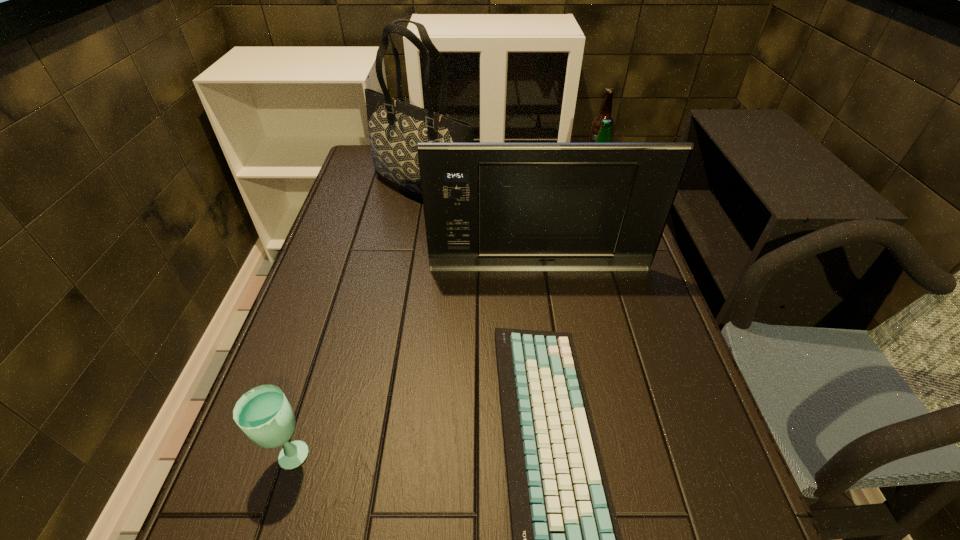
You are a GUI agent. You are given a task and a screenshot of the screen. Output one action in this format:
    pyautogui.click(x=<x>, y=<y>)
    Task: Click on the vacant space at the left edge
    
    Given the screenshot: What is the action you would take?
    pyautogui.click(x=366, y=268)

Identify the location of vacant region between the glass and the tallest object. The height and width of the screenshot is (540, 960). (356, 321).

Identify the location of object that is the fourth closest to the shortest object. (395, 127).

Identify the location of object that stands as the third closest to the nearer beer bottle. (395, 127).

What are the coordinates of `free spot that satisfies the following two spatial constraints: 1. on the label of the nearer beer bottle; 2. on the front panel of the fifth shortest object` in the screenshot? It's located at (604, 268).